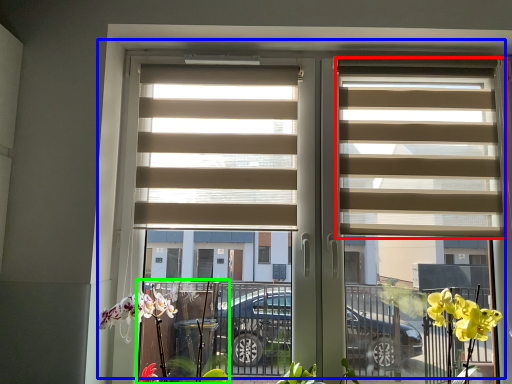
Question: Which object is the farthest from window blind (highlighted by a red box)? Choose among these: window (highlighted by a blue box) or plant (highlighted by a green box).

Choices:
 (A) window
 (B) plant

Answer: (B)